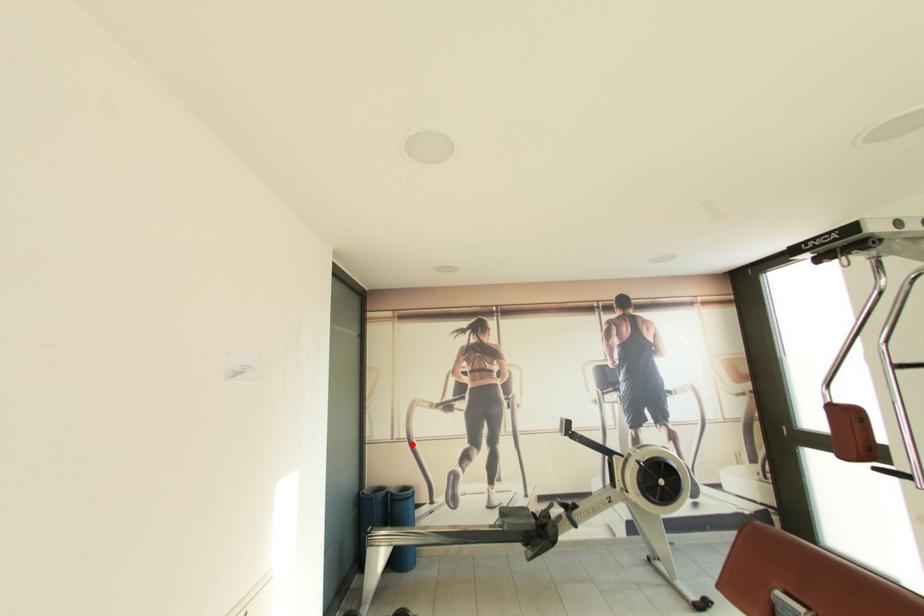
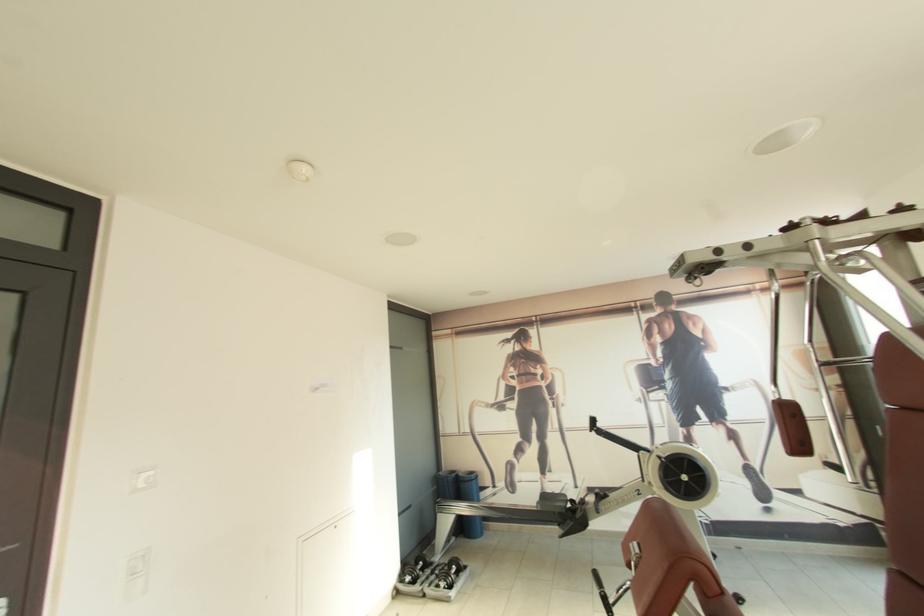
Locate, in the second image, the point that corresponds to the highlighted location in the first image.

(476, 438)